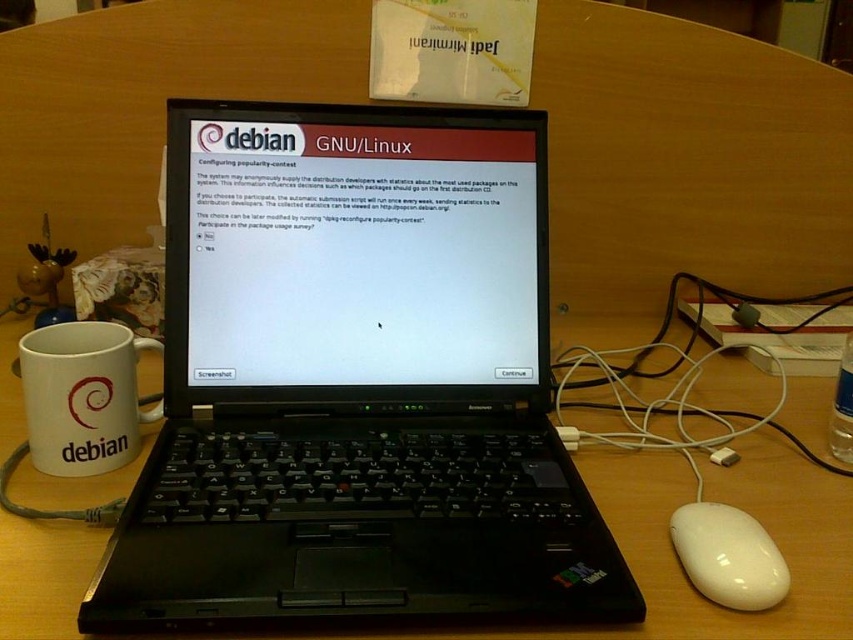
Which is behind, point (379, 445) or point (42, 346)?

Positioned behind is point (42, 346).

Describe the element at coordinates (357, 380) in the screenshot. I see `black plastic laptop at center` at that location.

Locate an element on the screen. black plastic laptop at center is located at coordinates (357, 380).

Is matte black monitor at center bigger than white glossy mouse at lower right?

Yes, matte black monitor at center is bigger than white glossy mouse at lower right.

Is point (183, 356) farther from camera compared to point (698, 513)?

Yes, it is.

Locate an element on the screen. matte black monitor at center is located at coordinates (354, 246).

This screenshot has width=853, height=640. I want to click on matte black monitor at center, so click(x=354, y=246).

How far apart are matte black monitor at center and white matte mug at left?

matte black monitor at center and white matte mug at left are 7.71 inches apart from each other.

Between matte black monitor at center and white matte mug at left, which one appears on the left side from the viewer's perspective?

From the viewer's perspective, white matte mug at left appears more on the left side.

Describe the element at coordinates (354, 246) in the screenshot. I see `matte black monitor at center` at that location.

You are a GUI agent. You are given a task and a screenshot of the screen. Output one action in this format:
    pyautogui.click(x=<x>, y=<y>)
    Task: Click on the matte black monitor at center
    The image size is (853, 640).
    Given the screenshot: What is the action you would take?
    pyautogui.click(x=354, y=246)